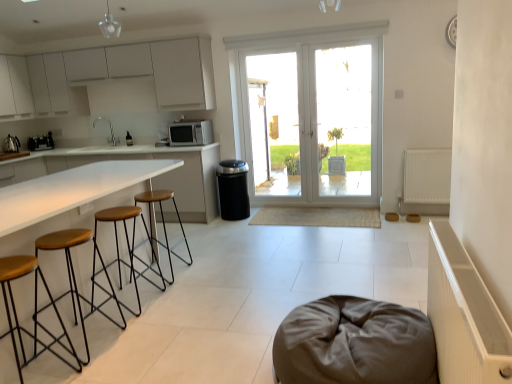
What do you see at coordinates (109, 127) in the screenshot?
I see `satin nickel faucet at upper left` at bounding box center [109, 127].

Describe the element at coordinates (354, 343) in the screenshot. I see `brown fabric bean bag at lower right` at that location.

What is the approximate height of white glass door at center?

white glass door at center is 2.02 meters in height.

What is the approximate width of white ribbed radiator at right, the 2th radiator when ordered from back to front?

white ribbed radiator at right, the 2th radiator when ordered from back to front, is 13.19 centimeters in width.

Where is `white matte countertop at left`? This screenshot has width=512, height=384. white matte countertop at left is located at coordinates (72, 190).

I want to click on satin nickel faucet at upper left, so click(x=109, y=127).

Looking at this image, is wooden seat at left, which is the 4th stool in back-to-front order, further to camera compared to brown wood/black metal stool at left, marked as the 2th stool in a front-to-back arrangement?

No, wooden seat at left, which is the 4th stool in back-to-front order, is in front of brown wood/black metal stool at left, marked as the 2th stool in a front-to-back arrangement.

Would you say wooden seat at left, the first stool positioned from the front, is a long distance from brown wood/black metal stool at left, marked as the 2th stool in a front-to-back arrangement?

No, wooden seat at left, the first stool positioned from the front, is not far from brown wood/black metal stool at left, marked as the 2th stool in a front-to-back arrangement.

Visually, is wooden seat at left, the first stool positioned from the front, positioned to the left or to the right of brown wood/black metal stool at left, marked as the 2th stool in a front-to-back arrangement?

wooden seat at left, the first stool positioned from the front, is positioned on brown wood/black metal stool at left, marked as the 2th stool in a front-to-back arrangement,'s left side.

Is point (16, 268) positioned after point (87, 356)?

No, it is not.

Between white ribbed radiator at right, the first radiator when ordered from bottom to top, and wooden seat with metal legs at center, arranged as the 1th stool when viewed from the back, which one has smaller size?

wooden seat with metal legs at center, arranged as the 1th stool when viewed from the back, is smaller.

Is white ribbed radiator at right, acting as the first radiator starting from the left, placed right next to wooden seat with metal legs at center, arranged as the 1th stool when viewed from the back?

white ribbed radiator at right, acting as the first radiator starting from the left, and wooden seat with metal legs at center, arranged as the 1th stool when viewed from the back, are not in contact.

Between white ribbed radiator at right, acting as the 2th radiator starting from the right, and wooden seat with metal legs at center, arranged as the 1th stool when viewed from the back, which one appears on the right side from the viewer's perspective?

white ribbed radiator at right, acting as the 2th radiator starting from the right.

Which of these two, white ribbed radiator at right, the 2th radiator when ordered from back to front, or wooden seat with metal legs at center, arranged as the 1th stool when viewed from the back, stands shorter?

Standing shorter between the two is wooden seat with metal legs at center, arranged as the 1th stool when viewed from the back.

Based on their positions, is transparent glass door at center, which is the 1th window screen in right-to-left order, located to the left or right of white matte cabinets at upper left?

Clearly, transparent glass door at center, which is the 1th window screen in right-to-left order, is on the right of white matte cabinets at upper left in the image.

In the image, is transparent glass door at center, which is the 1th window screen in right-to-left order, positioned in front of or behind white matte cabinets at upper left?

Visually, transparent glass door at center, which is the 1th window screen in right-to-left order, is located behind white matte cabinets at upper left.

Is transparent glass door at center, positioned as the 2th window screen in left-to-right order, not inside white matte cabinets at upper left?

Yes.

Where is `the 1st window screen behind the white matte cabinets at upper left, starting your count from the anchor`? the 1st window screen behind the white matte cabinets at upper left, starting your count from the anchor is located at coordinates (345, 119).

Which point is more distant from viewer, (274, 157) or (29, 144)?

The point (274, 157) is more distant.

Is transparent glass door at center, acting as the 2th window screen starting from the right, wider than matte black coffee machine at left?

No.

Considering the sizes of objects transparent glass door at center, the 1th window screen when ordered from left to right, and matte black coffee machine at left in the image provided, who is smaller, transparent glass door at center, the 1th window screen when ordered from left to right, or matte black coffee machine at left?

matte black coffee machine at left is smaller.

How far apart are transparent glass door at center, acting as the 2th window screen starting from the right, and matte black coffee machine at left?

9.65 feet.

Is wooden seat at left, the first stool positioned from the front, in contact with white matte countertop at center?

wooden seat at left, the first stool positioned from the front, is not next to white matte countertop at center, and they're not touching.

How many degrees apart are the facing directions of wooden seat at left, the first stool positioned from the front, and white matte countertop at center?

wooden seat at left, the first stool positioned from the front, and white matte countertop at center are facing 90.7 degrees away from each other.

Looking at this image, does wooden seat at left, the first stool positioned from the front, have a larger size compared to white matte countertop at center?

No.

From the image's perspective, is wooden seat at left, the first stool positioned from the front, on white matte countertop at center?

No, from the image's perspective, wooden seat at left, the first stool positioned from the front, is not above white matte countertop at center.

Where is `door above the white matte countertop at left (from a real-world perspective)`? The width and height of the screenshot is (512, 384). door above the white matte countertop at left (from a real-world perspective) is located at coordinates (311, 115).

From the image's perspective, does white matte countertop at left appear higher than white glass door at center?

No, from the image's perspective, white matte countertop at left is not on top of white glass door at center.

Looking at this image, considering the relative sizes of white matte countertop at left and white glass door at center in the image provided, is white matte countertop at left smaller than white glass door at center?

No.

From their relative heights in the image, would you say white matte countertop at left is taller or shorter than white glass door at center?

white matte countertop at left is shorter than white glass door at center.

Consider the image. Can you tell me how much white matte countertop at center and white matte radiator at right, marked as the 2th radiator in a front-to-back arrangement, differ in facing direction?

The angular difference between white matte countertop at center and white matte radiator at right, marked as the 2th radiator in a front-to-back arrangement, is 0.287 degrees.

Is white matte countertop at center aimed at white matte radiator at right, which appears as the 1th radiator when viewed from the right?

No, white matte countertop at center is not turned towards white matte radiator at right, which appears as the 1th radiator when viewed from the right.

Does point (75, 164) appear closer or farther from the camera than point (430, 183)?

Clearly, point (75, 164) is closer to the camera than point (430, 183).

From the image's perspective, is white matte countertop at center located above or below white matte radiator at right, which is the 2th radiator from left to right?

From the image's perspective, white matte countertop at center appears above white matte radiator at right, which is the 2th radiator from left to right.

I want to click on the 1st stool above the wooden seat at left, the first stool positioned from the front (from the image's perspective), so click(x=74, y=273).

Where is `the 1st radiator counting from the right side of the wooden seat with metal legs at center, marked as the 4th stool in a front-to-back arrangement`? the 1st radiator counting from the right side of the wooden seat with metal legs at center, marked as the 4th stool in a front-to-back arrangement is located at coordinates (464, 315).

Estimate the real-world distances between objects in this image. Which object is further from white matte cabinets at upper left, white matte countertop at left or white matte countertop at center?

Among the two, white matte countertop at left is located further to white matte cabinets at upper left.

Which object lies further to the anchor point white ribbed radiator at right, the first radiator when ordered from bottom to top, white matte countertop at center or wooden seat with metal legs at center, marked as the 4th stool in a front-to-back arrangement?

white matte countertop at center.

Based on their spatial positions, is white matte microwave at center, the 2th appliance positioned from the left, or white ribbed radiator at right, the first radiator when ordered from bottom to top, closer to wooden seat with metal legs at left, the 2th stool viewed from the back?

white matte microwave at center, the 2th appliance positioned from the left, is positioned closer to the anchor wooden seat with metal legs at left, the 2th stool viewed from the back.

Estimate the real-world distances between objects in this image. Which object is further from white matte countertop at left, white matte countertop at center or wooden seat at left, the first stool positioned from the front?

white matte countertop at center is further to white matte countertop at left.

Considering their positions, is white matte microwave at center, which ranks as the first appliance in right-to-left order, positioned closer to brown wood/black metal stool at left, acting as the 3th stool starting from the back, than white ribbed radiator at right, the 2th radiator positioned from the top?

white ribbed radiator at right, the 2th radiator positioned from the top.

Estimate the real-world distances between objects in this image. Which object is closer to white matte countertop at center, white glass door at center or wooden seat at left, which is the 4th stool in back-to-front order?

white glass door at center is closer to white matte countertop at center.

Looking at the image, which one is located further to brown wood/black metal stool at left, acting as the 3th stool starting from the back, white matte cabinets at upper left or matte black coffee machine at left?

Based on the image, matte black coffee machine at left appears to be further to brown wood/black metal stool at left, acting as the 3th stool starting from the back.

Considering their positions, is white matte countertop at left positioned closer to matte black coffee machine at left than brown fabric bean bag at lower right?

white matte countertop at left is closer to matte black coffee machine at left.

Locate an element on the screen. window screen between brushed metal kettle at left, acting as the second appliance starting from the right, and white glass door at center is located at coordinates (274, 123).

Find the location of `light fixture between wooden seat with metal legs at center, arranged as the 1th stool when viewed from the back, and satin nickel faucet at upper left in the front-back direction`. light fixture between wooden seat with metal legs at center, arranged as the 1th stool when viewed from the back, and satin nickel faucet at upper left in the front-back direction is located at coordinates (109, 25).

You are a GUI agent. You are given a task and a screenshot of the screen. Output one action in this format:
    pyautogui.click(x=<x>, y=<y>)
    Task: Click on the countertop between white matte cabinets at upper left and matte black coffee machine at left in the front-back direction
    The width and height of the screenshot is (512, 384).
    Given the screenshot: What is the action you would take?
    pyautogui.click(x=136, y=159)

Where is `counter between white ribbed radiator at right, the 2th radiator positioned from the top, and matte black coffee machine at left from front to back`? The height and width of the screenshot is (384, 512). counter between white ribbed radiator at right, the 2th radiator positioned from the top, and matte black coffee machine at left from front to back is located at coordinates (72, 190).